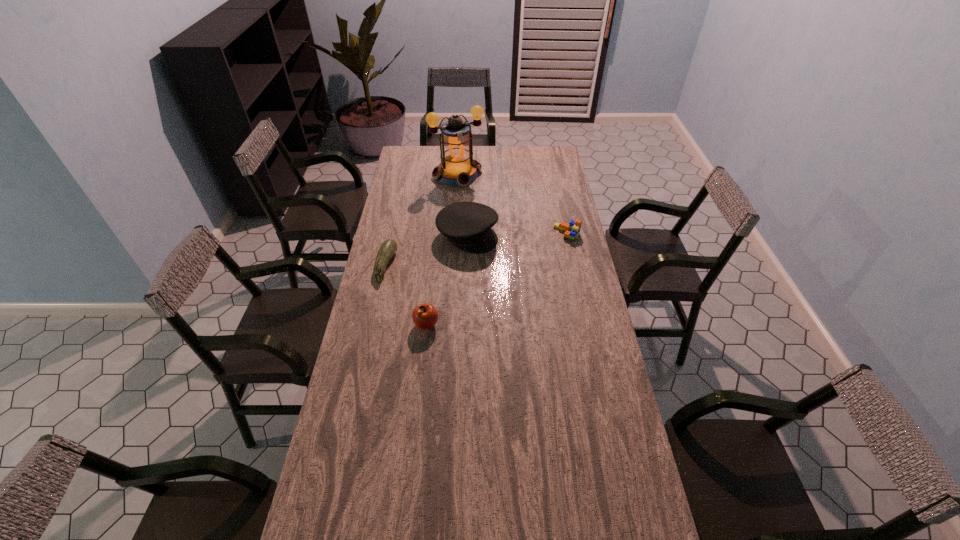
Locate an element on the screen. This screenshot has height=540, width=960. vacant region located 0.060m on the front-facing side of the lantern is located at coordinates (469, 194).

Locate an element on the screen. Image resolution: width=960 pixels, height=540 pixels. blank area located on the front-facing side of the beret is located at coordinates (533, 267).

I want to click on vacant space located 0.170m on the front-facing side of the beret, so click(x=524, y=263).

Where is `vacant space located on the front-facing side of the beret`? Image resolution: width=960 pixels, height=540 pixels. vacant space located on the front-facing side of the beret is located at coordinates (558, 279).

This screenshot has width=960, height=540. Identify the location of free region located 0.380m at the stem end of the leftmost object. (485, 280).

You are a GUI agent. You are given a task and a screenshot of the screen. Output one action in this format:
    pyautogui.click(x=<x>, y=<y>)
    Task: Click on the free space located at the stem end of the leftmost object
    
    Given the screenshot: What is the action you would take?
    pyautogui.click(x=480, y=279)

This screenshot has height=540, width=960. What are the coordinates of `vacant area located 0.160m at the stem end of the leftmost object` in the screenshot? It's located at (432, 274).

Image resolution: width=960 pixels, height=540 pixels. I want to click on object that is at the far edge, so click(457, 168).

In order to click on object situated at the left edge in this screenshot , I will do `click(388, 248)`.

The width and height of the screenshot is (960, 540). Find the location of `object at the right edge`. object at the right edge is located at coordinates (572, 230).